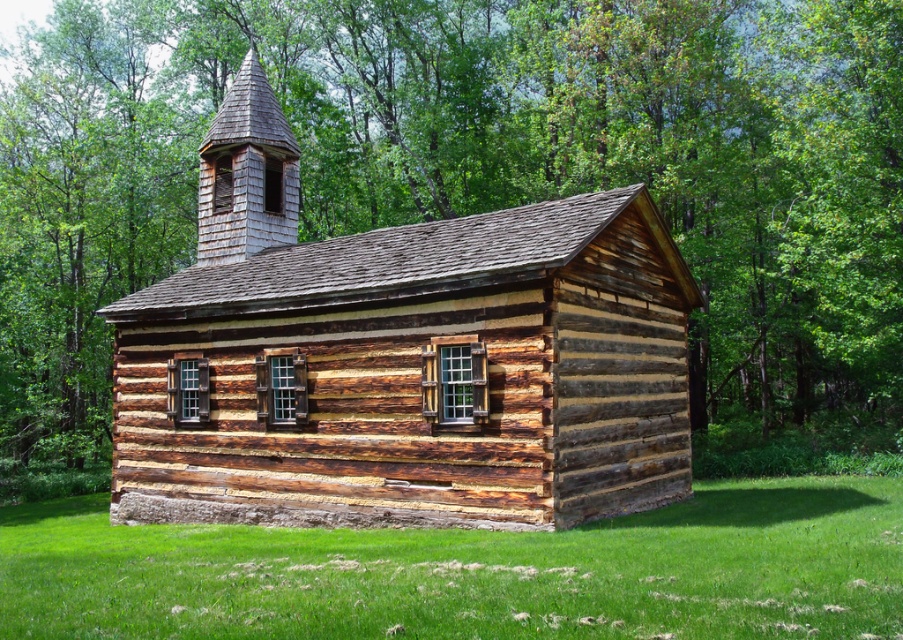
Who is more forward, (422, 330) or (439, 568)?

Positioned in front is point (439, 568).

Can you confirm if weathered wood log cabin at center is smaller than green grass at lower center?

No, weathered wood log cabin at center is not smaller than green grass at lower center.

Is point (545, 358) positioned in front of point (715, 604)?

No, (545, 358) is behind (715, 604).

You are a GUI agent. You are given a task and a screenshot of the screen. Output one action in this format:
    pyautogui.click(x=<x>, y=<y>)
    Task: Click on the weathered wood log cabin at center
    
    Given the screenshot: What is the action you would take?
    pyautogui.click(x=413, y=376)